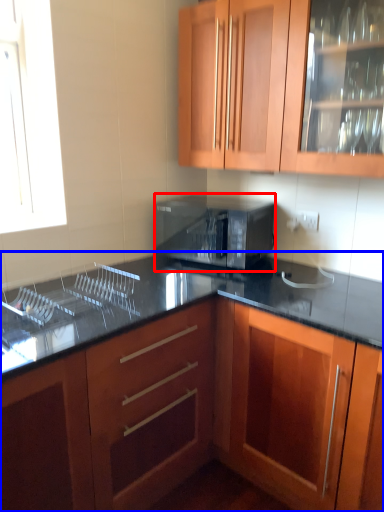
Question: Which point is further to the camera, microwave oven (highlighted by a red box) or cabinetry (highlighted by a blue box)?

Choices:
 (A) microwave oven
 (B) cabinetry

Answer: (A)